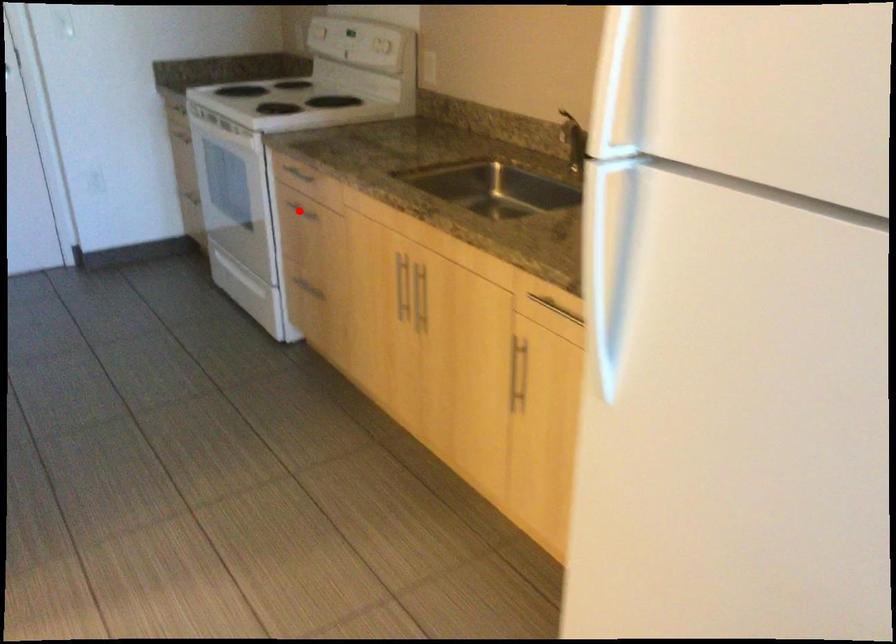
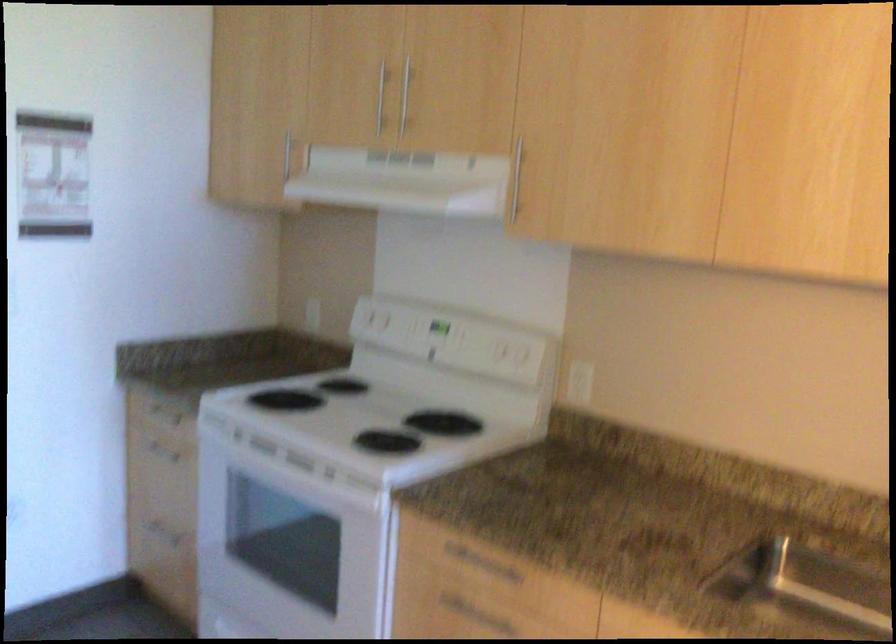
Find the pixel in the second image that matches the highlighted location in the first image.

(466, 609)